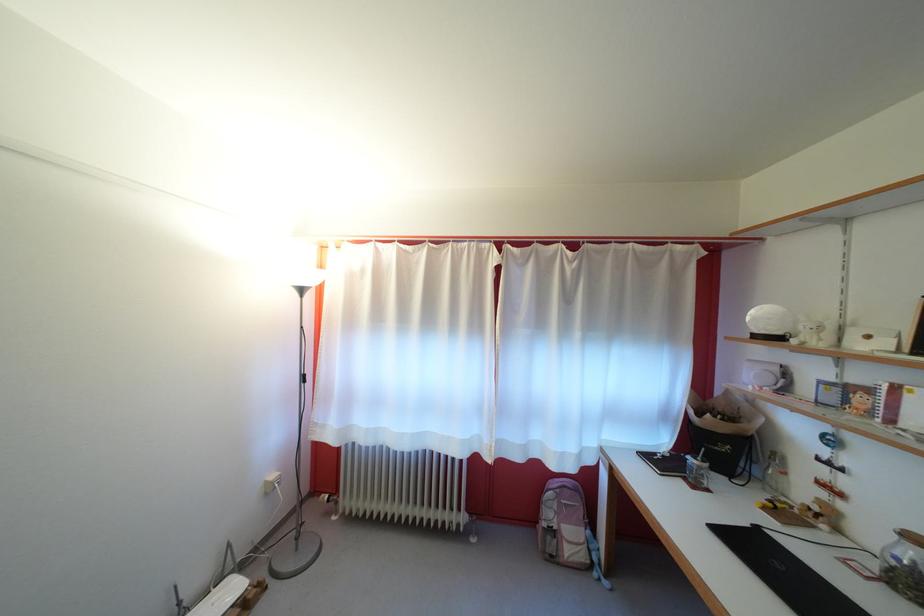
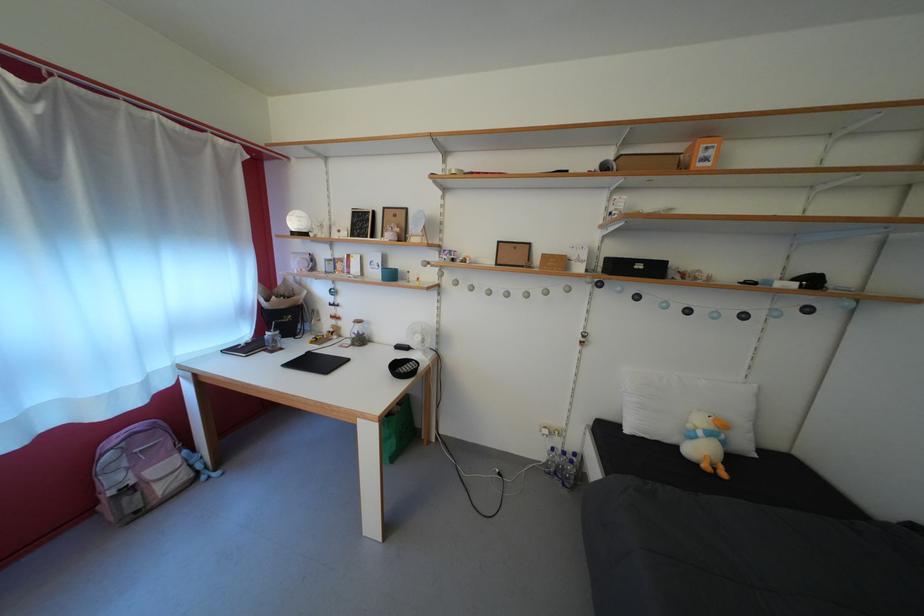
In the second image, find the point that corresponds to pixel 764 533 in the first image.

(317, 360)